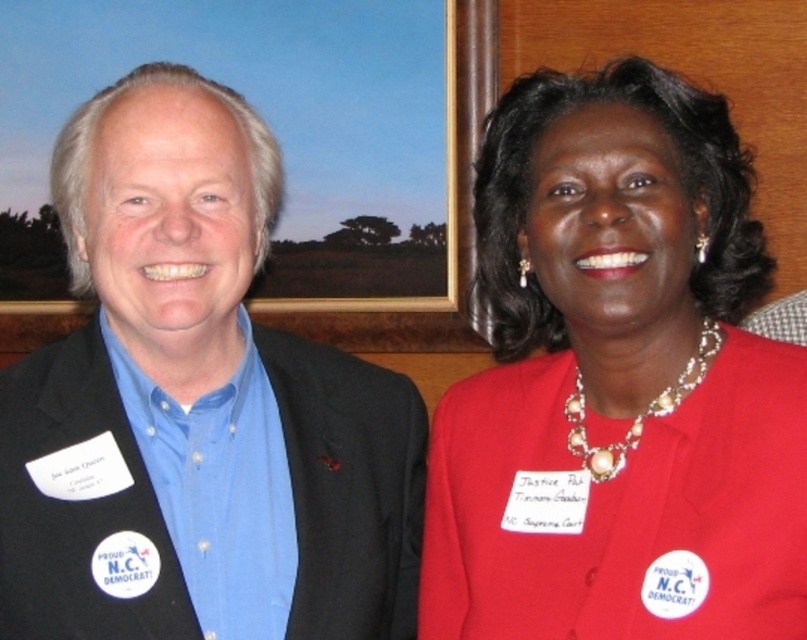
In the scene shown: Based on the scene description, which object is shorter in height between the matte red blazer at center and the blue fabric shirt at center?

The matte red blazer at center is shorter in height compared to the blue fabric shirt at center.

You are a photographer trying to capture a clear photo of both the matte red blazer at center and the blue fabric shirt at center. Since you can only focus on one object at a time, which one should you choose to ensure the other is still somewhat in focus?

You should focus on the matte red blazer at center because it is closer to the viewer. This will keep the blue fabric shirt at center, which is farther away, somewhat in focus.

Looking at this image, you are at a formal event and want to take a photo of both the person at point (674, 150) and the person at point (230, 280). Which person is closer to the camera?

The person at point (674, 150) is closer to the camera because point (674, 150) is in front of point (230, 280).